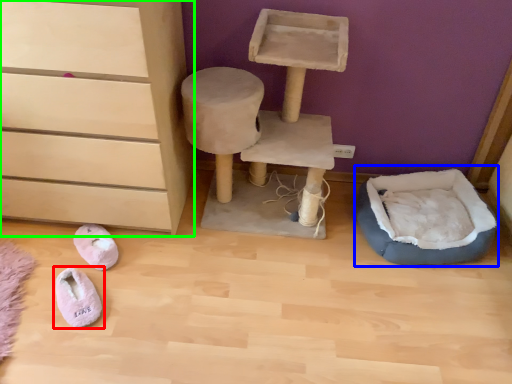
Question: Considering the real-world distances, which object is closest to footwear (highlighted by a red box)? bean bag chair (highlighted by a blue box) or chest of drawers (highlighted by a green box).

Choices:
 (A) bean bag chair
 (B) chest of drawers

Answer: (B)